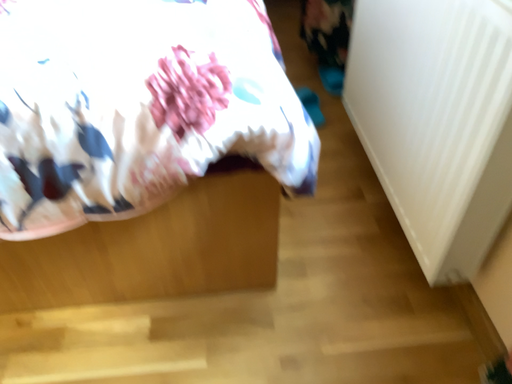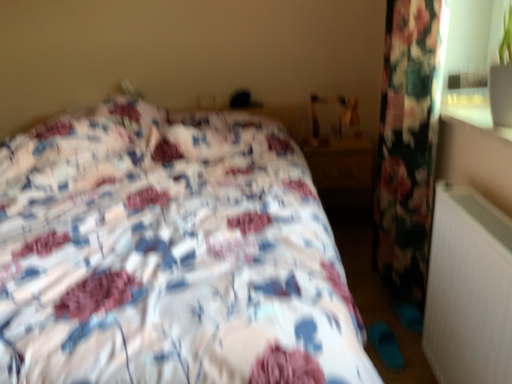
Question: How did the camera likely rotate when shooting the video?

Choices:
 (A) rotated downward
 (B) rotated upward

Answer: (B)